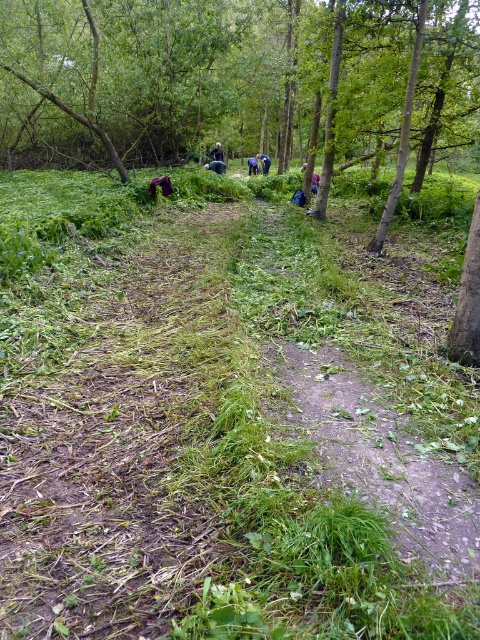
Question: Which object is closer to the camera taking this photo?

Choices:
 (A) green leafy tree at center
 (B) dark brown leather jacket at center
 (C) blue denim jacket at center
 (D) green leafy grass at center

Answer: (D)

Question: Which of these objects is positioned farthest from the green leafy tree at center?

Choices:
 (A) blue denim jacket at center
 (B) green leafy grass at center
 (C) dark brown leather jacket at center

Answer: (A)

Question: Estimate the real-world distances between objects in this image. Which object is farther from the green leafy grass at center?

Choices:
 (A) blue denim jacket at center
 (B) dark blue shirt at center

Answer: (B)

Question: Can you confirm if green leafy grass at center is positioned to the left of green leafy tree at center?

Choices:
 (A) no
 (B) yes

Answer: (B)

Question: Can you confirm if green leafy grass at center is positioned to the left of dark brown leather jacket at center?

Choices:
 (A) yes
 (B) no

Answer: (B)

Question: Is green leafy tree at center below blue denim jacket at center?

Choices:
 (A) no
 (B) yes

Answer: (A)